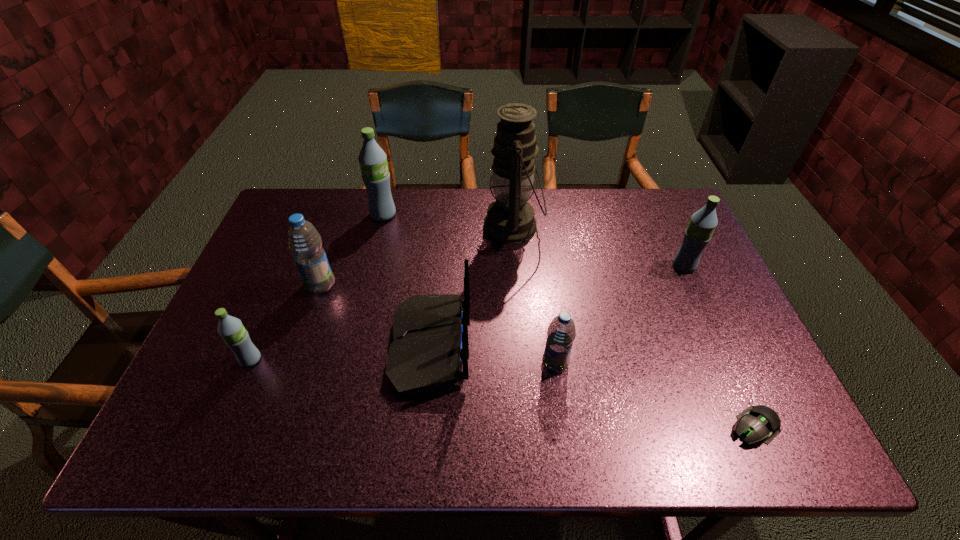
Identify the location of free area in between the smallest green water bottle and the fifth object from right to left. (341, 353).

At what (x,y) coordinates should I click in order to perform the action: click on vacant space that's between the bigger blue water bottle and the rightmost green water bottle. Please return your answer as a coordinate pair (x, y). Looking at the image, I should click on (502, 275).

Locate an element on the screen. This screenshot has width=960, height=540. free space between the router and the nearer blue water bottle is located at coordinates (492, 355).

Find the location of a particular element. vacant region between the bigger blue water bottle and the biggest green water bottle is located at coordinates (352, 250).

Find the location of a particular element. Image resolution: width=960 pixels, height=540 pixels. vacant space that is in between the leftmost object and the left blue water bottle is located at coordinates (285, 322).

Find the location of a particular element. The height and width of the screenshot is (540, 960). the fourth closest object to the tallest object is located at coordinates (702, 224).

The height and width of the screenshot is (540, 960). In order to click on the second closest object relative to the nearest object in this screenshot , I will do `click(702, 224)`.

Point out which water bottle is positioned as the fourth nearest to the nearest object. Please provide its 2D coordinates. Your answer should be formatted as a tuple, i.e. [(x, y)], where the tuple contains the x and y coordinates of a point satisfying the conditions above.

[(373, 163)]

Identify which water bottle is located as the fifth nearest to the nearest object. Please provide its 2D coordinates. Your answer should be formatted as a tuple, i.e. [(x, y)], where the tuple contains the x and y coordinates of a point satisfying the conditions above.

[(231, 329)]

Identify the location of green water bottle that is the second closest to the nearer blue water bottle. (373, 163).